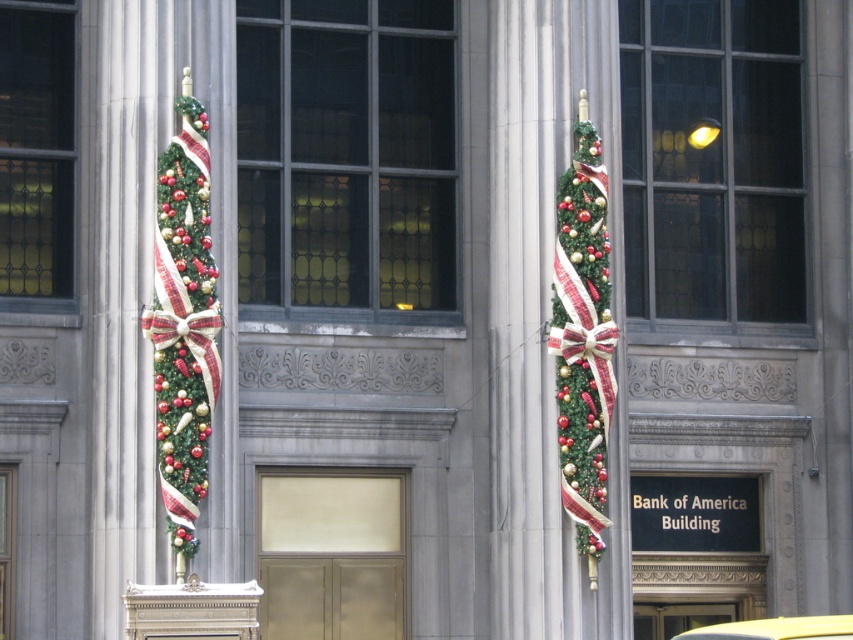
Between green textured wreath at left and yellow matte car at center, which one has less height?

Standing shorter between the two is green textured wreath at left.

Does green textured wreath at left appear under yellow matte car at center?

No.

The height and width of the screenshot is (640, 853). Find the location of `green textured wreath at left`. green textured wreath at left is located at coordinates (183, 324).

What do you see at coordinates (183, 324) in the screenshot? This screenshot has width=853, height=640. I see `green textured wreath at left` at bounding box center [183, 324].

Is the position of green textured wreath at left less distant than that of green textured christmas tree at right?

Yes, green textured wreath at left is in front of green textured christmas tree at right.

Find the location of a particular element. green textured wreath at left is located at coordinates (183, 324).

Is green textured christmas tree at right thinner than yellow matte car at center?

Indeed, green textured christmas tree at right has a lesser width compared to yellow matte car at center.

Does green textured christmas tree at right appear under yellow matte car at center?

Incorrect, green textured christmas tree at right is not positioned below yellow matte car at center.

The image size is (853, 640). What do you see at coordinates (583, 339) in the screenshot? I see `green textured christmas tree at right` at bounding box center [583, 339].

Locate an element on the screen. green textured christmas tree at right is located at coordinates (583, 339).